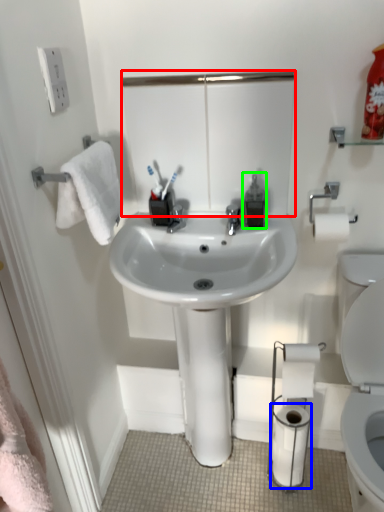
Question: Based on their relative distances, which object is farther from mirror (highlighted by a red box)? Choose from toilet paper (highlighted by a blue box) and soap dispenser (highlighted by a green box).

Choices:
 (A) toilet paper
 (B) soap dispenser

Answer: (A)